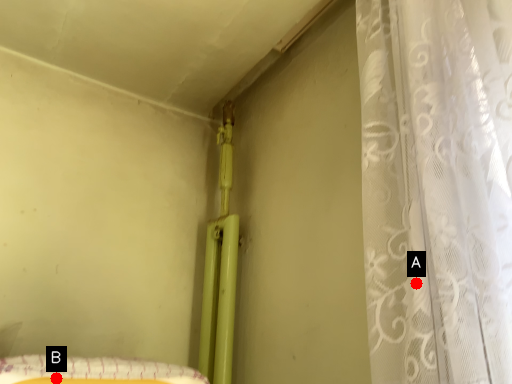
Question: Two points are circled on the image, labeled by A and B beside each circle. Which point is farther to the camera?

Choices:
 (A) A is further
 (B) B is further

Answer: (B)